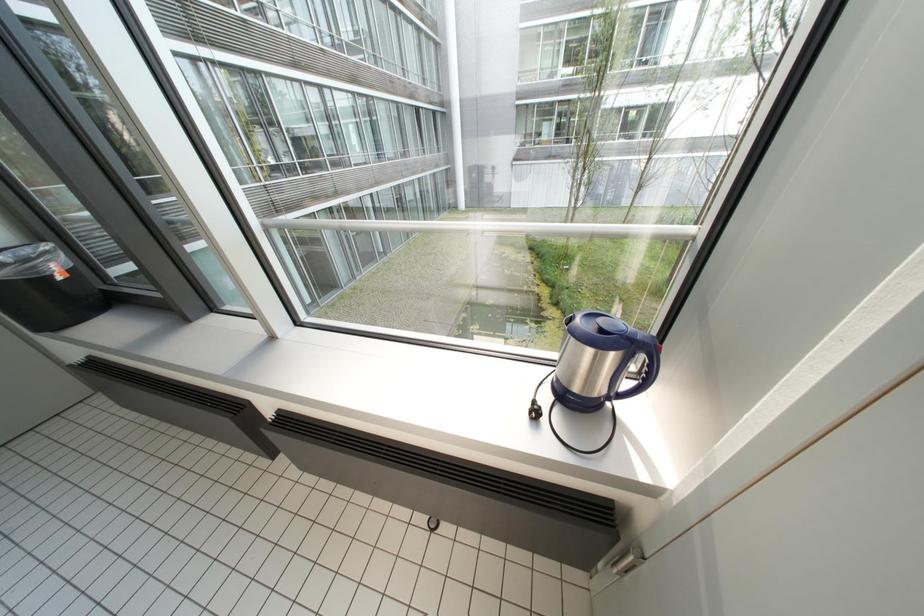
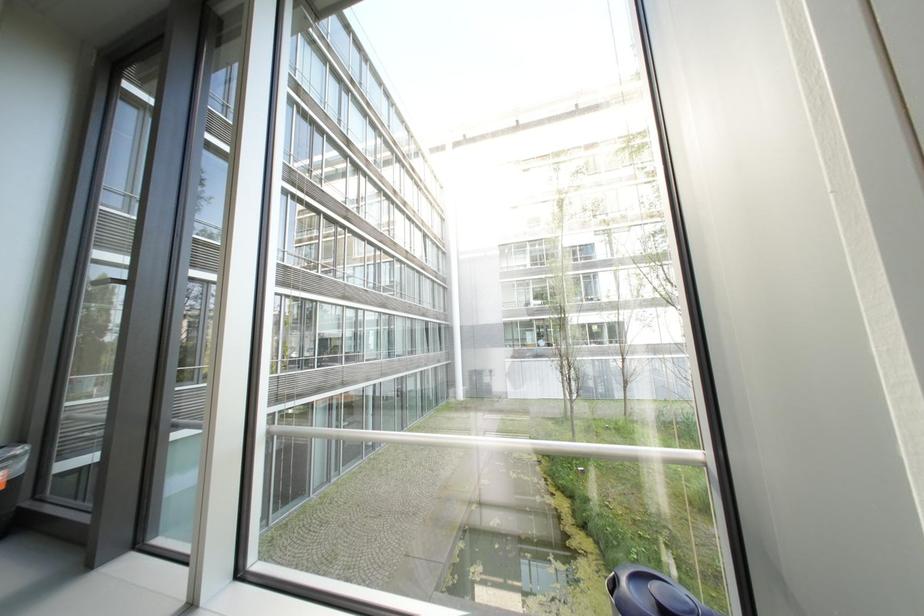
Question: The images are taken continuously from a first-person perspective. In which direction is your viewpoint rotating?

Choices:
 (A) Left
 (B) Right
 (C) Up
 (D) Down

Answer: (C)